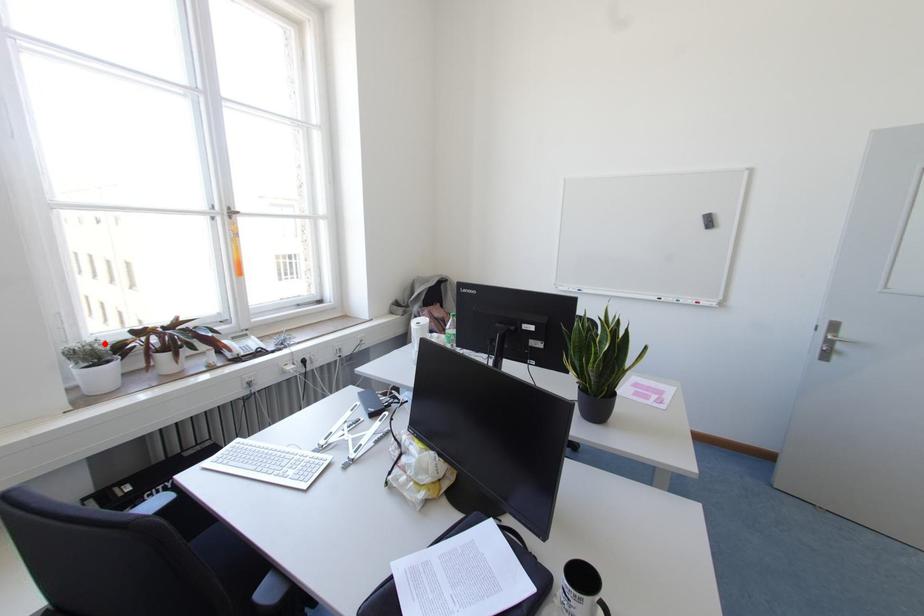
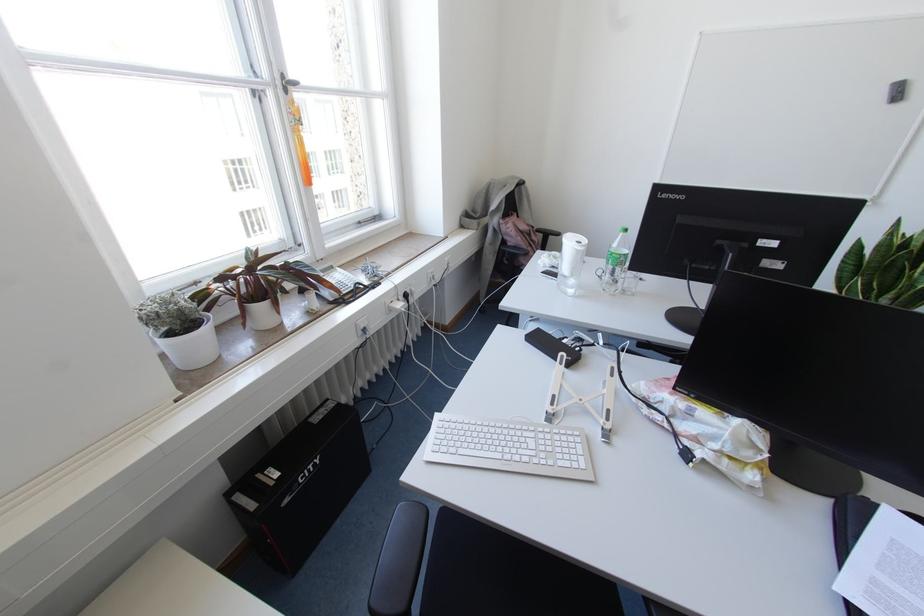
Find the pixel in the second image that matches the highlighted location in the first image.

(186, 298)